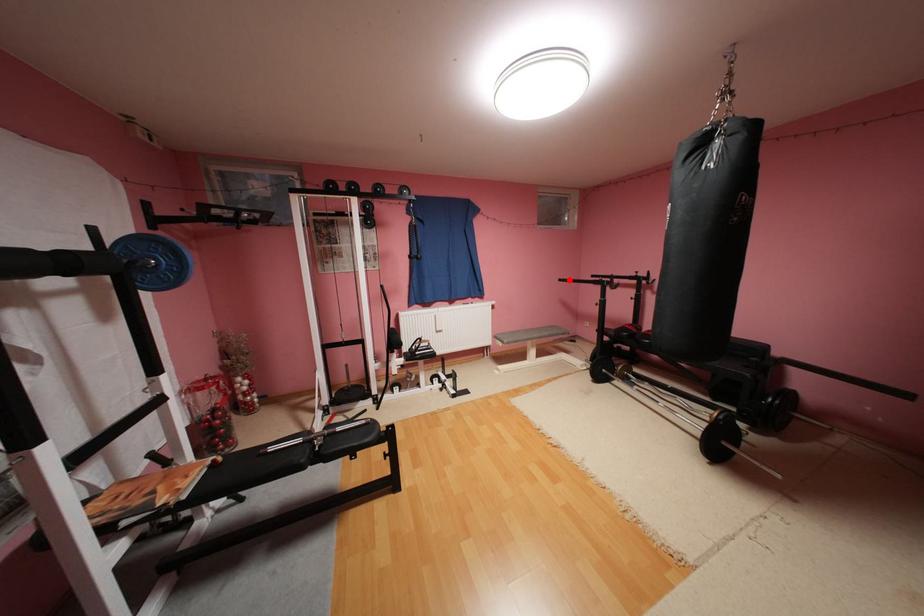
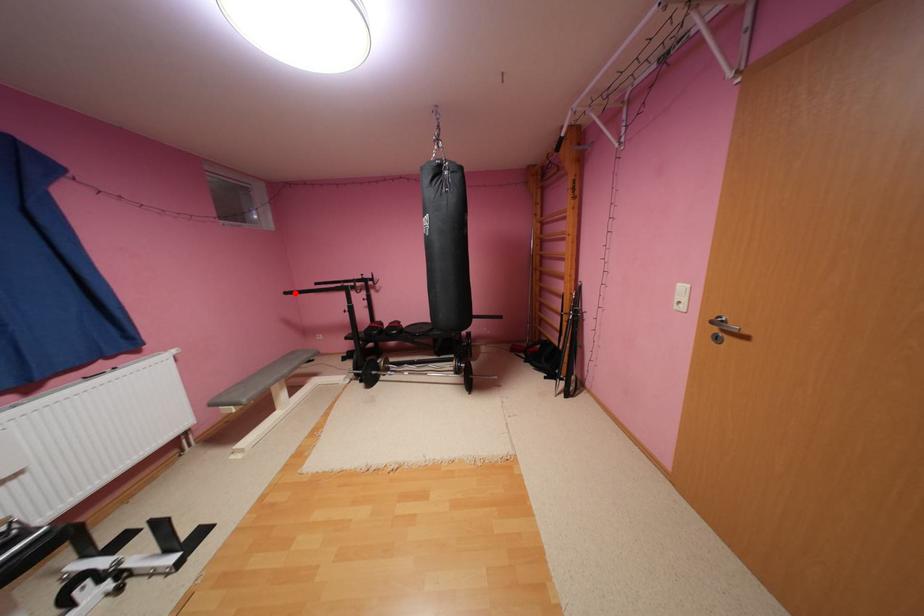
I am providing you with two images of the same scene from different viewpoints. A red point is marked on the first image and another point is marked on the second image. Do the highlighted points in image1 and image2 indicate the same real-world spot?

Yes